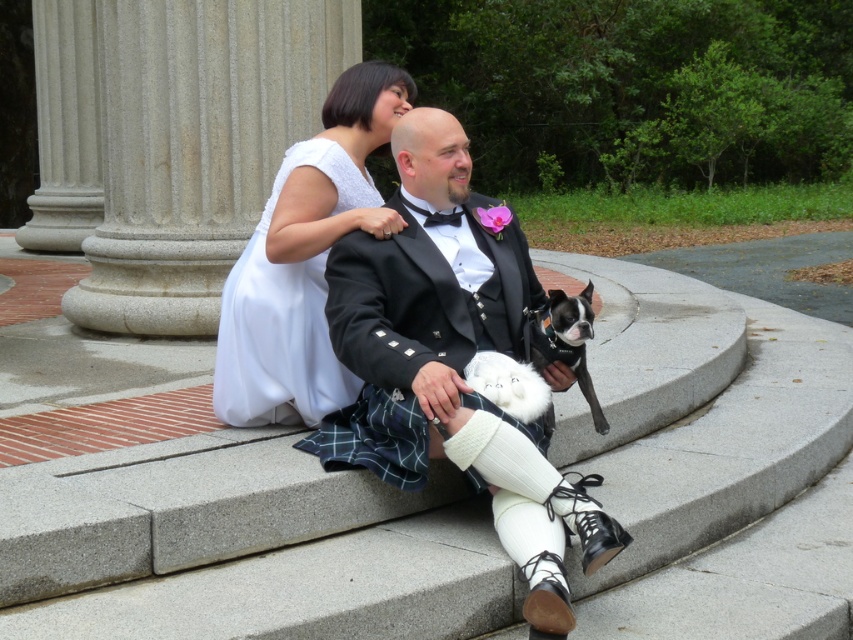
Between point (547, 593) and point (537, 355), which one is positioned behind?

The point (537, 355) is behind.

Can you confirm if shiny black suit at center is shorter than black glossy dog at center?

In fact, shiny black suit at center may be taller than black glossy dog at center.

The height and width of the screenshot is (640, 853). What do you see at coordinates (451, 362) in the screenshot? I see `shiny black suit at center` at bounding box center [451, 362].

In order to click on shiny black suit at center in this screenshot , I will do click(x=451, y=362).

What do you see at coordinates (566, 340) in the screenshot? I see `black glossy dog at center` at bounding box center [566, 340].

Which is below, black glossy dog at center or white fluffy dog at center?

white fluffy dog at center is lower down.

Is point (578, 372) farther from camera compared to point (480, 362)?

Yes, point (578, 372) is farther from viewer.

Locate an element on the screen. This screenshot has height=640, width=853. black glossy dog at center is located at coordinates (566, 340).

Is shiny black suit at center thinner than white fluffy dog at center?

No.

What do you see at coordinates (451, 362) in the screenshot?
I see `shiny black suit at center` at bounding box center [451, 362].

Where is `shiny black suit at center`? The width and height of the screenshot is (853, 640). shiny black suit at center is located at coordinates (451, 362).